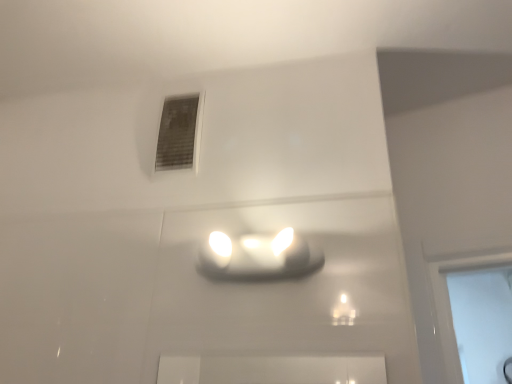
Where is `matte gray vent at upper center`? matte gray vent at upper center is located at coordinates (178, 132).

What do you see at coordinates (178, 132) in the screenshot? I see `matte gray vent at upper center` at bounding box center [178, 132].

Consider the image. In order to face matte gray vent at upper center, should I rotate leftwards or rightwards?

It's best to rotate left around 10.378 degrees.

Measure the distance between matte white lamp at center and camera.

They are 37.05 inches apart.

Describe the element at coordinates (258, 257) in the screenshot. The image size is (512, 384). I see `matte white lamp at center` at that location.

The width and height of the screenshot is (512, 384). Identify the location of matte white lamp at center. (258, 257).

The image size is (512, 384). What are the coordinates of `matte gray vent at upper center` in the screenshot? It's located at (178, 132).

Would you say matte gray vent at upper center is to the left or to the right of matte white lamp at center in the picture?

Clearly, matte gray vent at upper center is on the left of matte white lamp at center in the image.

Is the position of matte gray vent at upper center less distant than that of matte white lamp at center?

That is False.

Is point (157, 167) behind point (295, 239)?

Yes, it is.

Looking at this image, from the image's perspective, which object appears higher, matte gray vent at upper center or matte white lamp at center?

matte gray vent at upper center appears higher in the image.

From a real-world perspective, is matte gray vent at upper center on matte white lamp at center?

Indeed, from a real-world perspective, matte gray vent at upper center stands above matte white lamp at center.

Is matte gray vent at upper center thinner than matte white lamp at center?

Yes.

Considering the relative sizes of matte gray vent at upper center and matte white lamp at center in the image provided, is matte gray vent at upper center taller than matte white lamp at center?

Correct, matte gray vent at upper center is much taller as matte white lamp at center.

Can you confirm if matte gray vent at upper center is bigger than matte white lamp at center?

Incorrect, matte gray vent at upper center is not larger than matte white lamp at center.

Is matte gray vent at upper center inside the boundaries of matte white lamp at center, or outside?

matte gray vent at upper center is outside matte white lamp at center.

Is matte gray vent at upper center touching matte white lamp at center?

No, matte gray vent at upper center is not with matte white lamp at center.

Does matte gray vent at upper center turn towards matte white lamp at center?

No, matte gray vent at upper center is not oriented towards matte white lamp at center.

How different are the orientations of matte gray vent at upper center and matte white lamp at center in degrees?

matte gray vent at upper center and matte white lamp at center are facing 0.0714 degrees away from each other.

At what (x,y) coordinates should I click in order to perform the action: click on window on the left of matte white lamp at center. Please return your answer as a coordinate pair (x, y). The height and width of the screenshot is (384, 512). Looking at the image, I should click on (178, 132).

Can you confirm if matte white lamp at center is positioned to the left of matte gray vent at upper center?

No, matte white lamp at center is not to the left of matte gray vent at upper center.

Is matte white lamp at center further to the viewer compared to matte gray vent at upper center?

No, matte white lamp at center is closer to the camera.

Which is farther from the camera, (201, 272) or (188, 105)?

The point (188, 105) is farther from the camera.

From the image's perspective, between matte white lamp at center and matte gray vent at upper center, which one is located above?

matte gray vent at upper center appears higher in the image.

From a real-world perspective, relative to matte gray vent at upper center, is matte white lamp at center vertically above or below?

In terms of real-world spatial position, matte white lamp at center is below matte gray vent at upper center.

Which of these two, matte white lamp at center or matte gray vent at upper center, is thinner?

matte gray vent at upper center is thinner.

Between matte white lamp at center and matte gray vent at upper center, which one has more height?

matte gray vent at upper center is taller.

In terms of size, does matte white lamp at center appear bigger or smaller than matte gray vent at upper center?

Considering their sizes, matte white lamp at center takes up more space than matte gray vent at upper center.

Is matte white lamp at center outside of matte gray vent at upper center?

Indeed, matte white lamp at center is completely outside matte gray vent at upper center.

Is matte white lamp at center touching matte gray vent at upper center?

No, matte white lamp at center is not beside matte gray vent at upper center.

Is matte gray vent at upper center at the back of matte white lamp at center?

That's not correct — matte white lamp at center is not looking away from matte gray vent at upper center.

This screenshot has width=512, height=384. What are the coordinates of `window above the matte white lamp at center (from the image's perspective)` in the screenshot? It's located at (178, 132).

This screenshot has width=512, height=384. In order to click on lamp on the right of matte gray vent at upper center in this screenshot , I will do `click(258, 257)`.

Image resolution: width=512 pixels, height=384 pixels. Find the location of `window that appears behind the matte white lamp at center`. window that appears behind the matte white lamp at center is located at coordinates (178, 132).